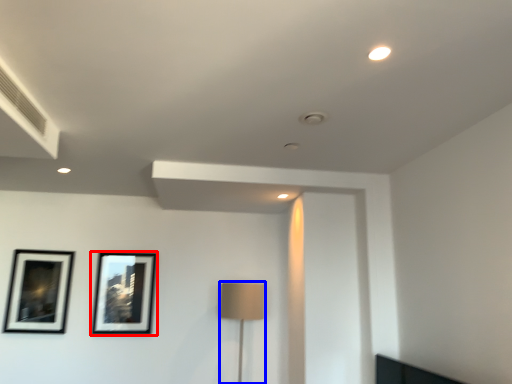
Question: Which object appears farthest to the camera in this image, picture frame (highlighted by a red box) or table lamp (highlighted by a blue box)?

Choices:
 (A) picture frame
 (B) table lamp

Answer: (A)